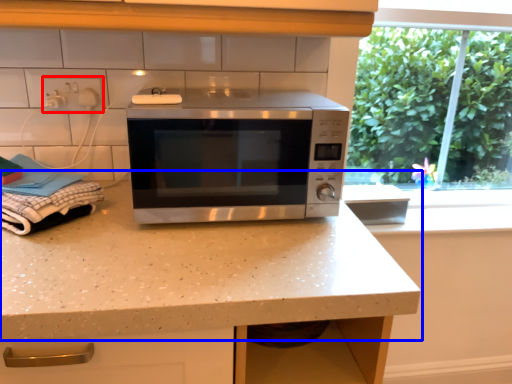
Question: Which object is further to the camera taking this photo, electric outlet (highlighted by a red box) or countertop (highlighted by a blue box)?

Choices:
 (A) electric outlet
 (B) countertop

Answer: (A)